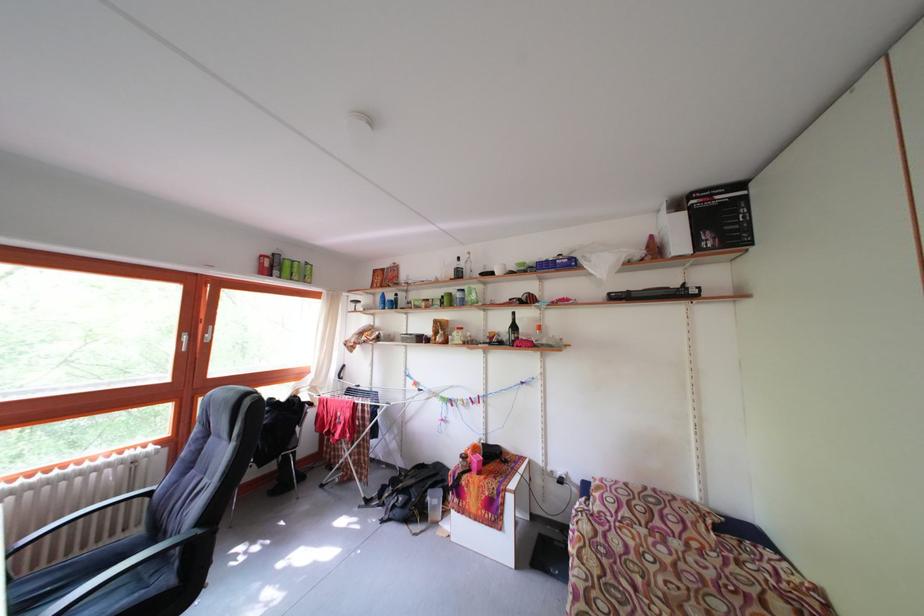
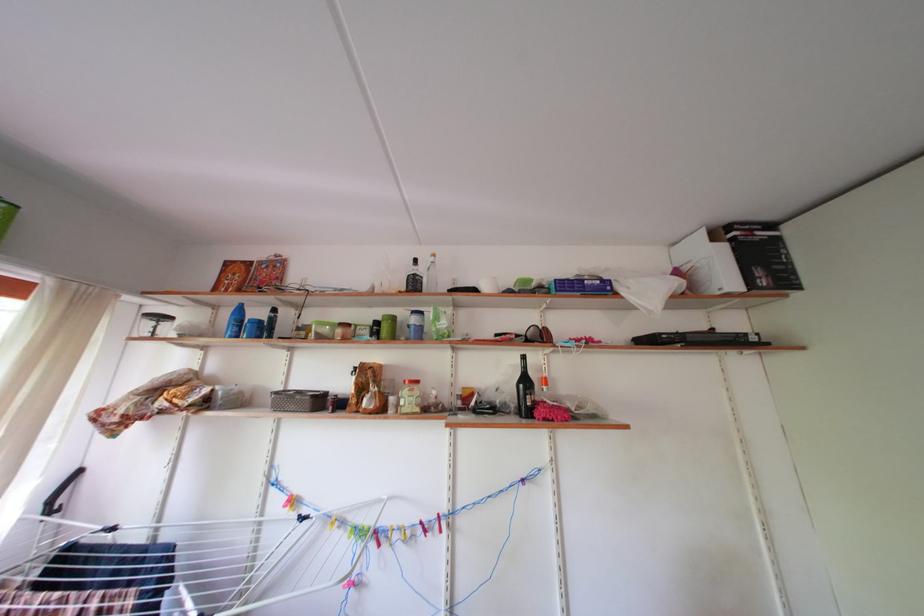
Find the pixel in the second image that matches point (523, 333) in the first image.

(533, 387)